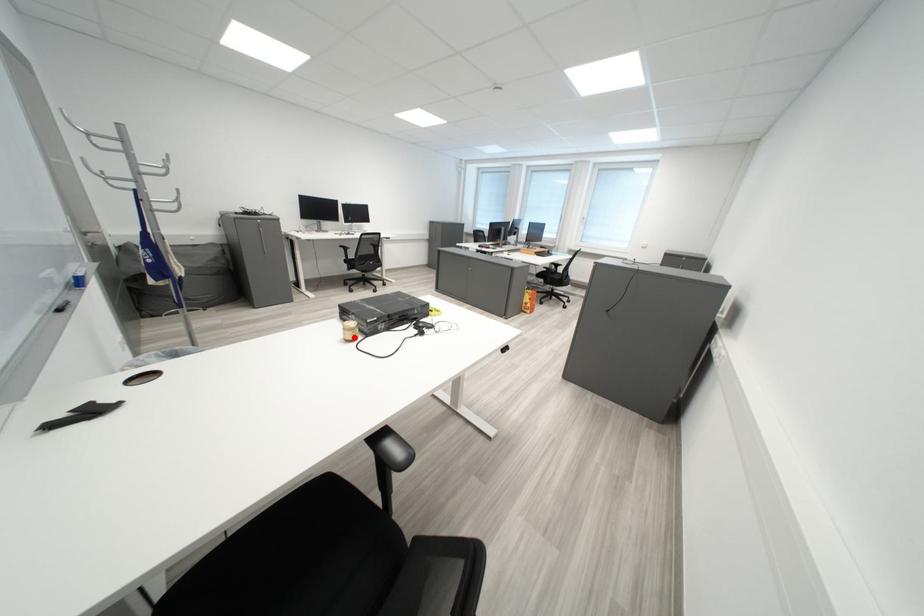
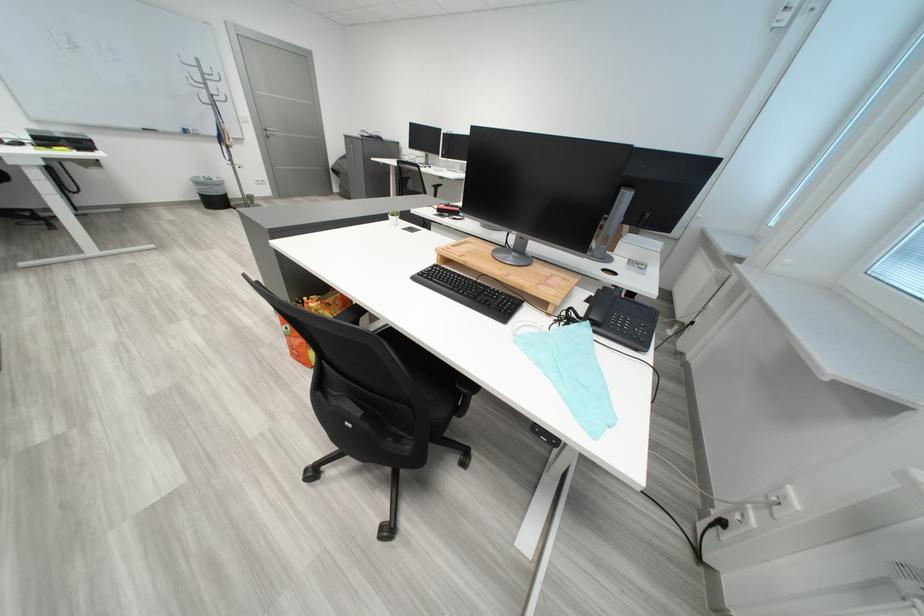
Question: I am providing you with two images of the same scene from different viewpoints. A red point is marked on the first image. Is the red point's position out of view in image 2?

Choices:
 (A) Yes
 (B) No

Answer: (A)